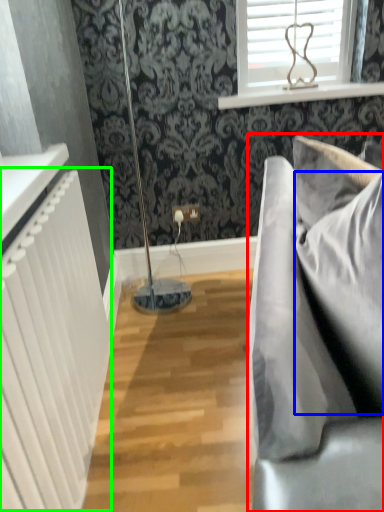
Question: Estimate the real-world distances between objects in this image. Which object is closer to studio couch (highlighted by a red box), pillow (highlighted by a blue box) or radiator (highlighted by a green box)?

Choices:
 (A) pillow
 (B) radiator

Answer: (A)